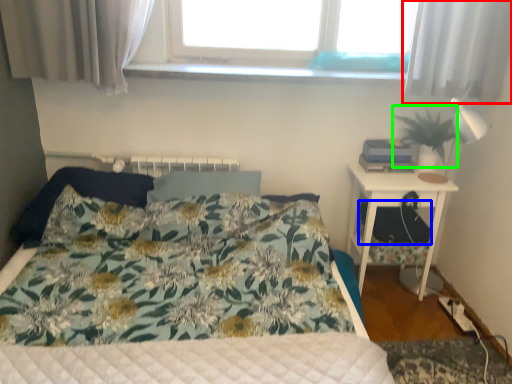
Question: Estimate the real-world distances between objects in this image. Which object is farther from curtain (highlighted by a red box), footrest (highlighted by a blue box) or plant (highlighted by a green box)?

Choices:
 (A) footrest
 (B) plant

Answer: (A)